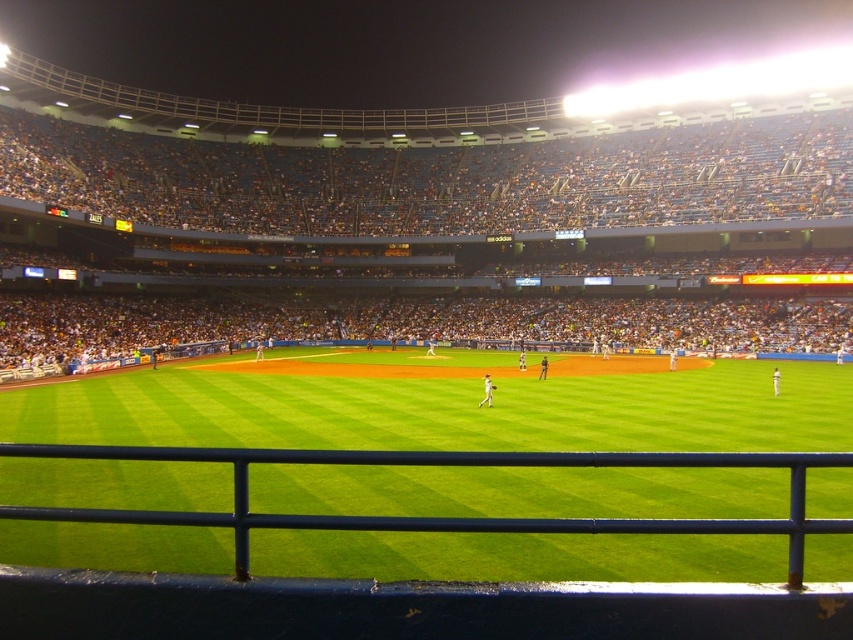
Question: Considering the relative positions of green grass at lower center and white matte uniform at center in the image provided, where is green grass at lower center located with respect to white matte uniform at center?

Choices:
 (A) right
 (B) left

Answer: (A)

Question: Among these objects, which one is nearest to the camera?

Choices:
 (A) white matte uniform at center
 (B) green grass at lower center

Answer: (B)

Question: Considering the relative positions of green grass at lower center and white matte uniform at center in the image provided, where is green grass at lower center located with respect to white matte uniform at center?

Choices:
 (A) below
 (B) above

Answer: (B)

Question: Which of the following is the closest to the observer?

Choices:
 (A) (482, 404)
 (B) (703, 369)

Answer: (A)

Question: Can you confirm if green grass at lower center is bigger than white matte uniform at center?

Choices:
 (A) no
 (B) yes

Answer: (B)